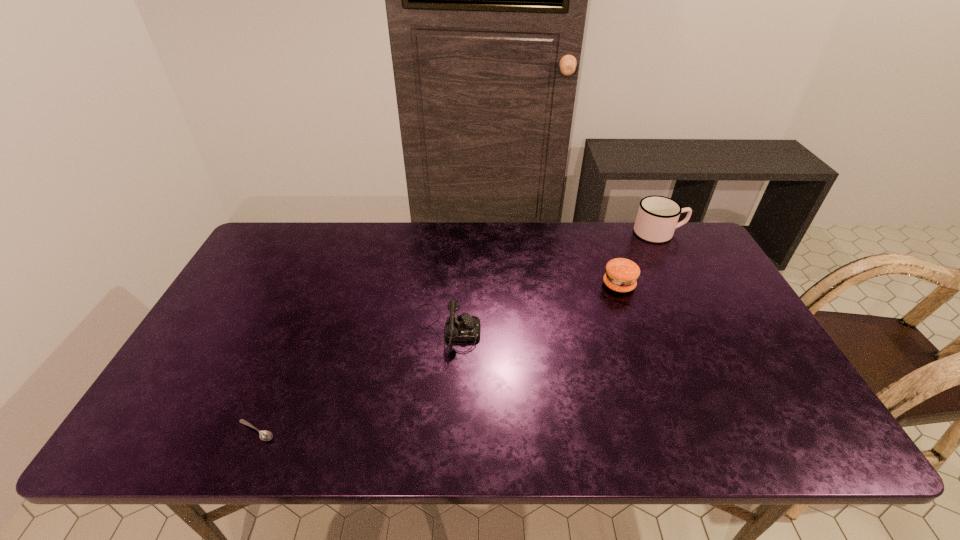
You are a GUI agent. You are given a task and a screenshot of the screen. Output one action in this format:
    pyautogui.click(x=<x>, y=<y>)
    Task: Click on the vacant space situated 0.100m on the back of the nearest object
    This screenshot has width=960, height=540.
    Given the screenshot: What is the action you would take?
    pyautogui.click(x=276, y=382)

Image resolution: width=960 pixels, height=540 pixels. Find the location of `object that is at the far edge`. object that is at the far edge is located at coordinates (657, 217).

You are a GUI agent. You are given a task and a screenshot of the screen. Output one action in this format:
    pyautogui.click(x=<x>, y=<y>)
    Task: Click on the object that is at the near edge
    The image size is (960, 540).
    Given the screenshot: What is the action you would take?
    pyautogui.click(x=264, y=435)

The image size is (960, 540). Find the location of `object at the right edge`. object at the right edge is located at coordinates (657, 217).

At what (x,y) coordinates should I click in order to perform the action: click on object present at the far right corner. Please return your answer as a coordinate pair (x, y). Looking at the image, I should click on (657, 217).

You are a GUI agent. You are given a task and a screenshot of the screen. Output one action in this format:
    pyautogui.click(x=<x>, y=<y>)
    Task: Click on the vacant area at the far edge
    This screenshot has width=960, height=540.
    Given the screenshot: What is the action you would take?
    pyautogui.click(x=442, y=238)

This screenshot has width=960, height=540. I want to click on vacant space at the near edge of the desktop, so click(x=684, y=448).

The width and height of the screenshot is (960, 540). In order to click on vacant space at the left edge of the desktop in this screenshot , I will do `click(209, 353)`.

In the image, there is a desktop. At what (x,y) coordinates should I click in order to perform the action: click on free space at the far left corner. Please return your answer as a coordinate pair (x, y). Image resolution: width=960 pixels, height=540 pixels. Looking at the image, I should click on (279, 249).

You are a GUI agent. You are given a task and a screenshot of the screen. Output one action in this format:
    pyautogui.click(x=<x>, y=<y>)
    Task: Click on the vacant area that lies between the second object from right to left and the soupspoon
    
    Given the screenshot: What is the action you would take?
    pyautogui.click(x=438, y=358)